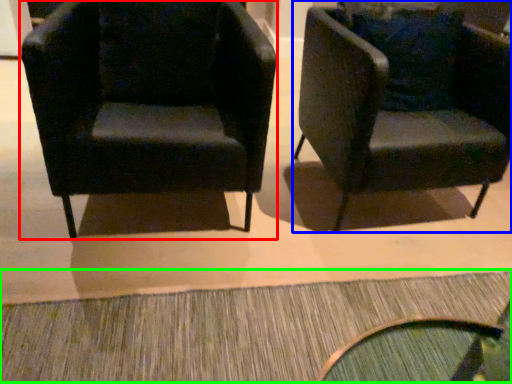
Question: Estimate the real-world distances between objects in this image. Which object is closer to chair (highlighted by a red box), chair (highlighted by a blue box) or doormat (highlighted by a green box)?

Choices:
 (A) chair
 (B) doormat

Answer: (A)